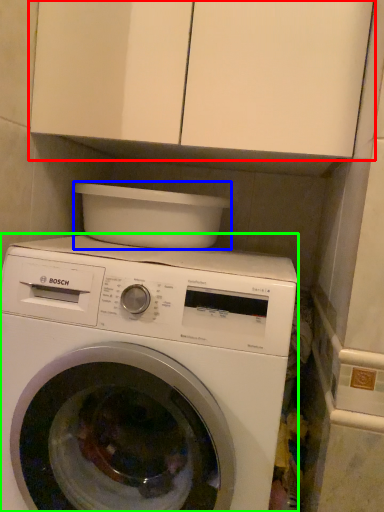
Question: Which object is the closest to the cabinetry (highlighted by a red box)? Choose among these: appliance (highlighted by a blue box) or washing machine (highlighted by a green box).

Choices:
 (A) appliance
 (B) washing machine

Answer: (A)